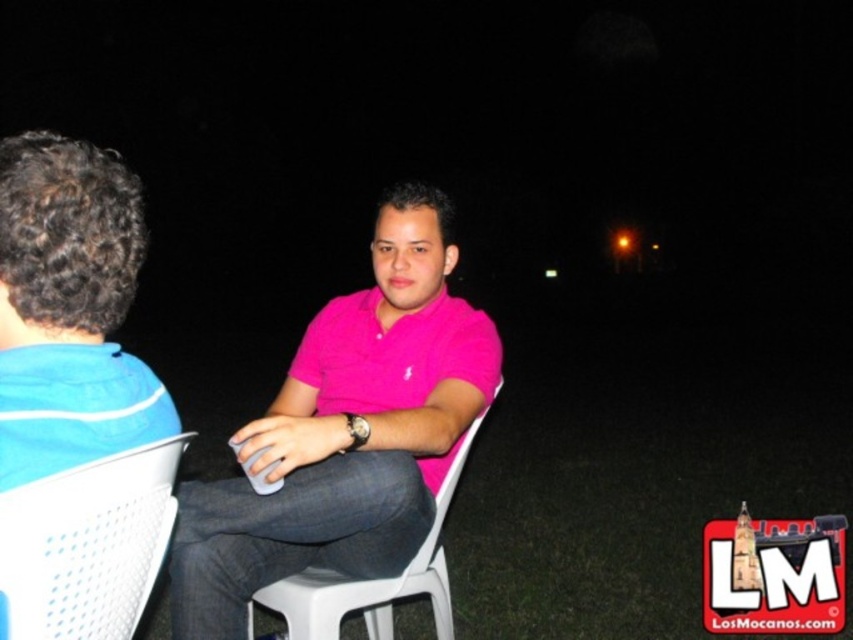
Question: Which point is closer to the camera?

Choices:
 (A) (421, 547)
 (B) (99, 484)

Answer: (B)

Question: Where is pink matte shirt at center located in relation to white plastic chair at center in the image?

Choices:
 (A) below
 (B) above

Answer: (B)

Question: Which of these objects is positioned farthest from the pink matte shirt at center?

Choices:
 (A) white plastic chair at center
 (B) blue cotton shirt at left

Answer: (B)

Question: Can you confirm if blue cotton shirt at left is smaller than white plastic chair at lower left?

Choices:
 (A) no
 (B) yes

Answer: (A)

Question: Can you confirm if blue cotton shirt at left is bigger than white plastic chair at lower left?

Choices:
 (A) yes
 (B) no

Answer: (A)

Question: Among these points, which one is farthest from the camera?

Choices:
 (A) (82, 240)
 (B) (33, 512)
 (C) (221, 552)
 (D) (433, 616)

Answer: (D)